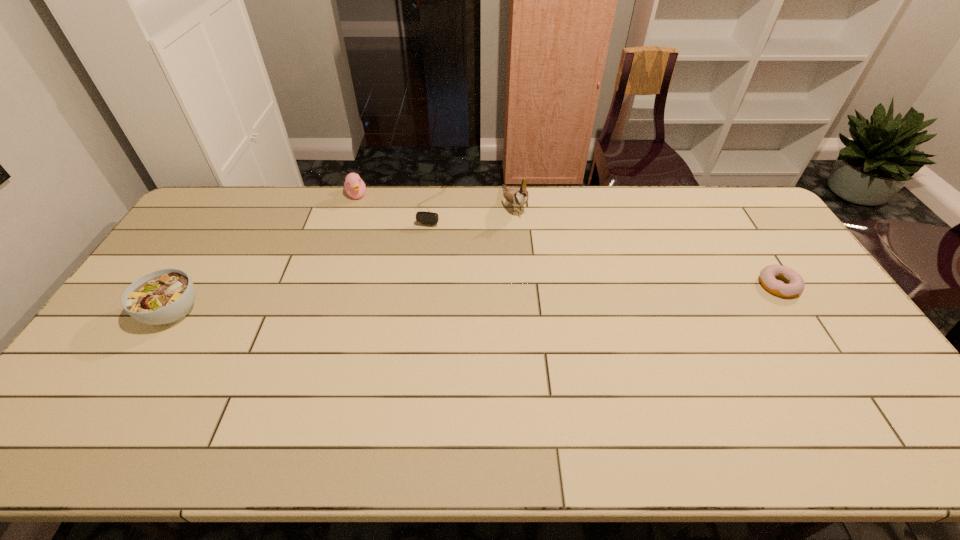
Identify the location of vacant spot on the desktop that is between the soup bowl and the shortest object and is positioned on the front-facing side of the third object from right to left. (396, 302).

Locate an element on the screen. Image resolution: width=960 pixels, height=540 pixels. free space on the desktop that is between the soup bowl and the doughnut and is positioned on the front-facing side of the fourth object from right to left is located at coordinates (417, 301).

Where is `free spot on the desktop that is between the soup bowl and the doughnut and is positioned at the face of the tallest object`? Image resolution: width=960 pixels, height=540 pixels. free spot on the desktop that is between the soup bowl and the doughnut and is positioned at the face of the tallest object is located at coordinates (566, 295).